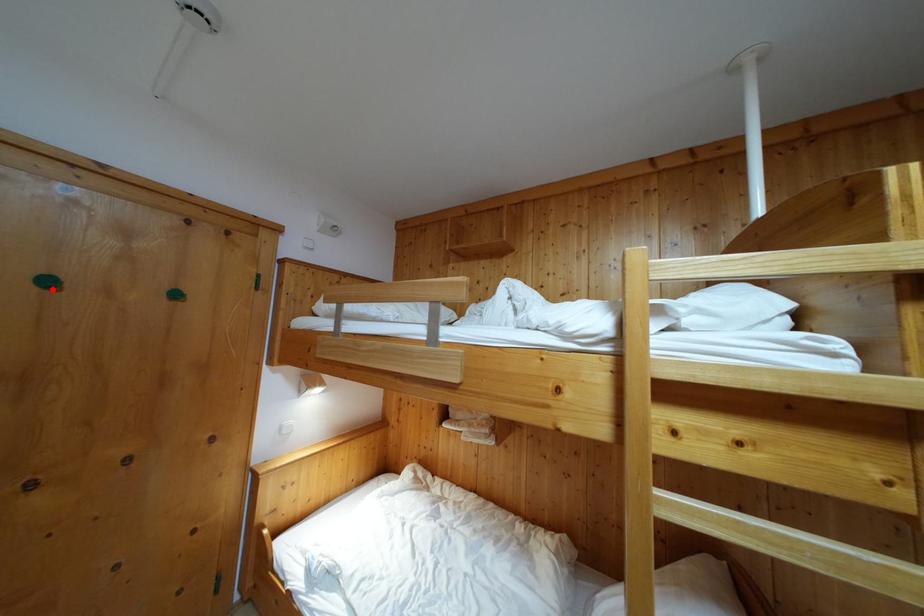
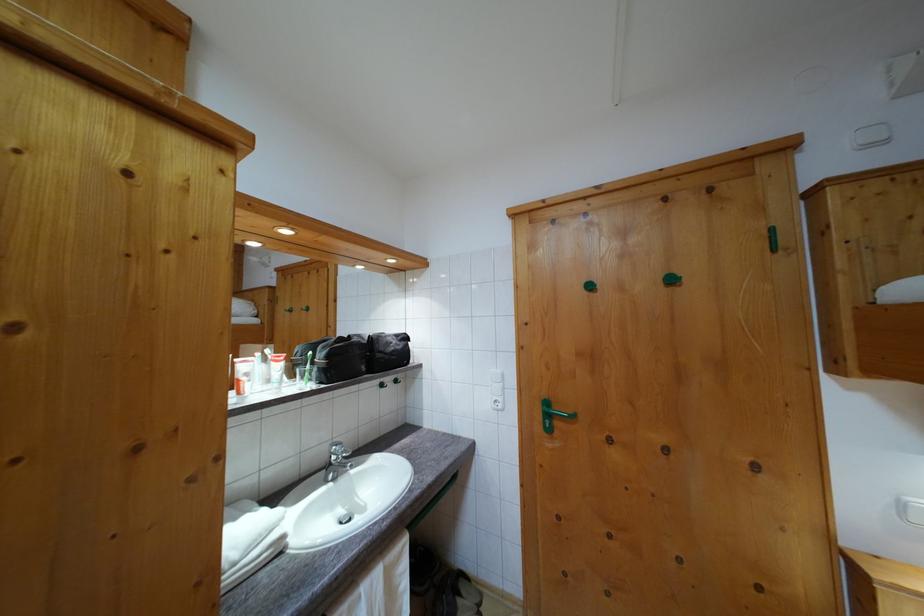
Where in the second image is the point corresponding to the highlighted location from the first image?

(593, 294)